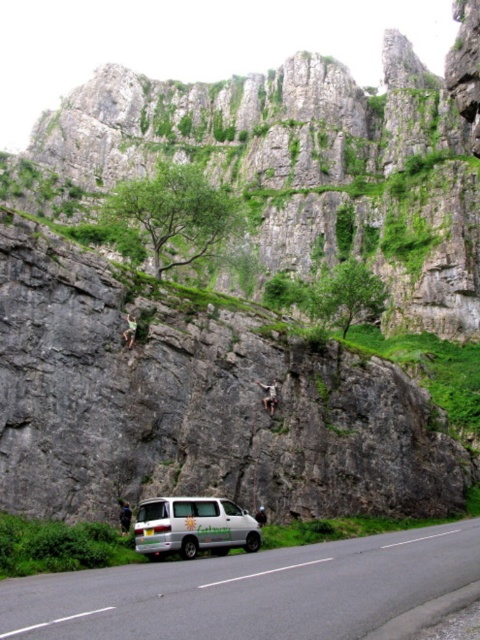
Is white asphalt road at lower center further to the viewer compared to white matte van at lower center?

That is False.

Is white asphalt road at lower center taller than white matte van at lower center?

Yes, white asphalt road at lower center is taller than white matte van at lower center.

Which is behind, point (1, 624) or point (179, 529)?

Point (179, 529)

Image resolution: width=480 pixels, height=640 pixels. What are the coordinates of `white asphalt road at lower center` in the screenshot? It's located at (250, 589).